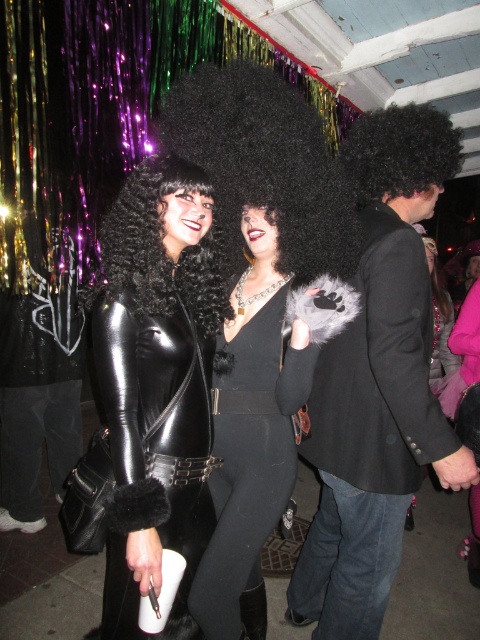
Can you confirm if black furry coat at right is positioned above black curly wig at center?

No, black furry coat at right is not above black curly wig at center.

Is black furry coat at right to the right of black curly wig at center from the viewer's perspective?

Correct, you'll find black furry coat at right to the right of black curly wig at center.

The image size is (480, 640). What do you see at coordinates (377, 384) in the screenshot?
I see `black furry coat at right` at bounding box center [377, 384].

Where is `black furry coat at right`? The image size is (480, 640). black furry coat at right is located at coordinates (377, 384).

Identify the location of black velvet dress at center. (249, 467).

Is black velvet dress at center shorter than black curly hair at upper right?

Incorrect, black velvet dress at center's height does not fall short of black curly hair at upper right's.

Is point (228, 420) in front of point (359, 189)?

Yes, it is.

I want to click on black velvet dress at center, so click(249, 467).

Who is shorter, black leather jacket at center or black curly hair at upper right?

black curly hair at upper right is shorter.

Is point (212, 342) positioned after point (368, 148)?

No, it is not.

At what (x,y) coordinates should I click in order to perform the action: click on black leather jacket at center. Please return your answer as a coordinate pair (x, y). This screenshot has width=480, height=640. Looking at the image, I should click on (157, 381).